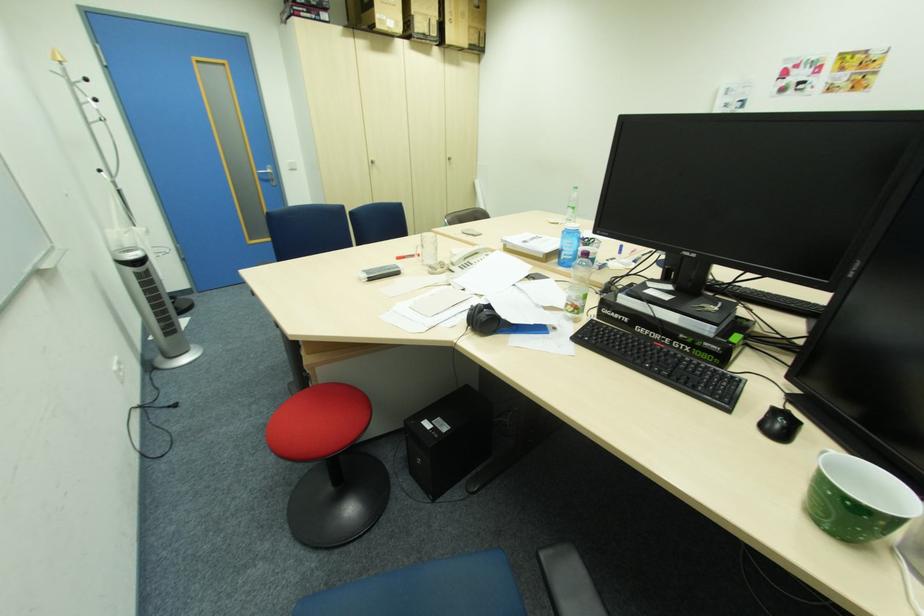
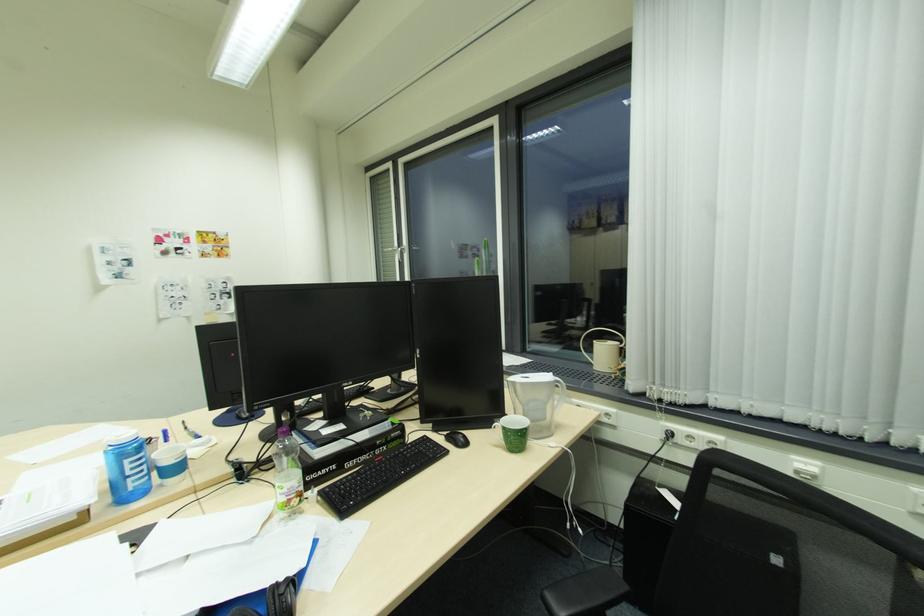
Find the pixel in the second image that matches the point at 586,268 in the first image.

(176, 482)